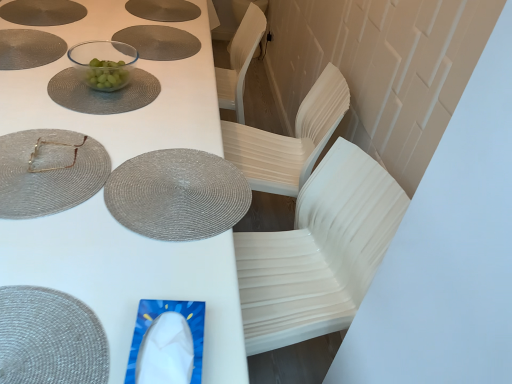
Identify the location of vacant space behind matte woven placemat at upper left, positioned as the second glass plate in back-to-front order. This screenshot has width=512, height=384. (84, 107).